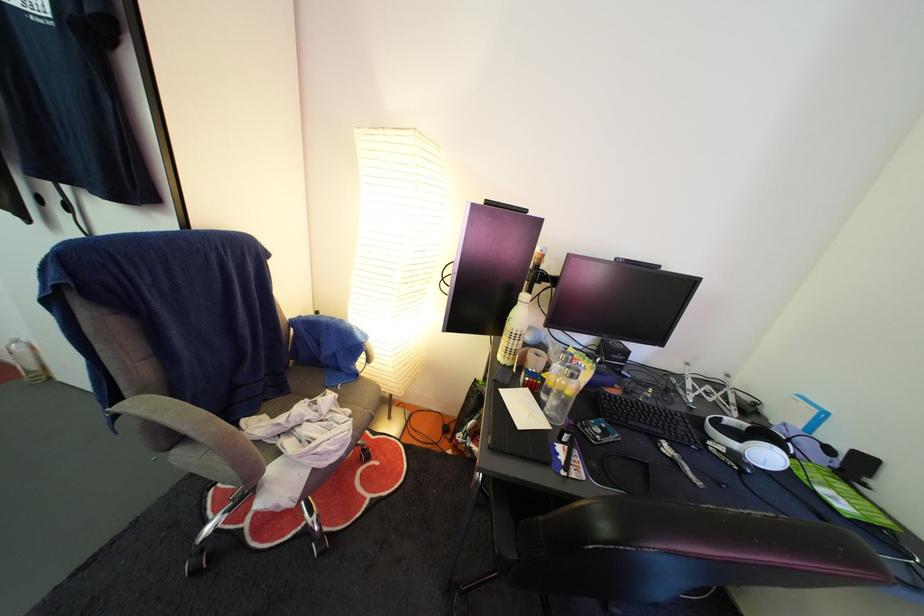
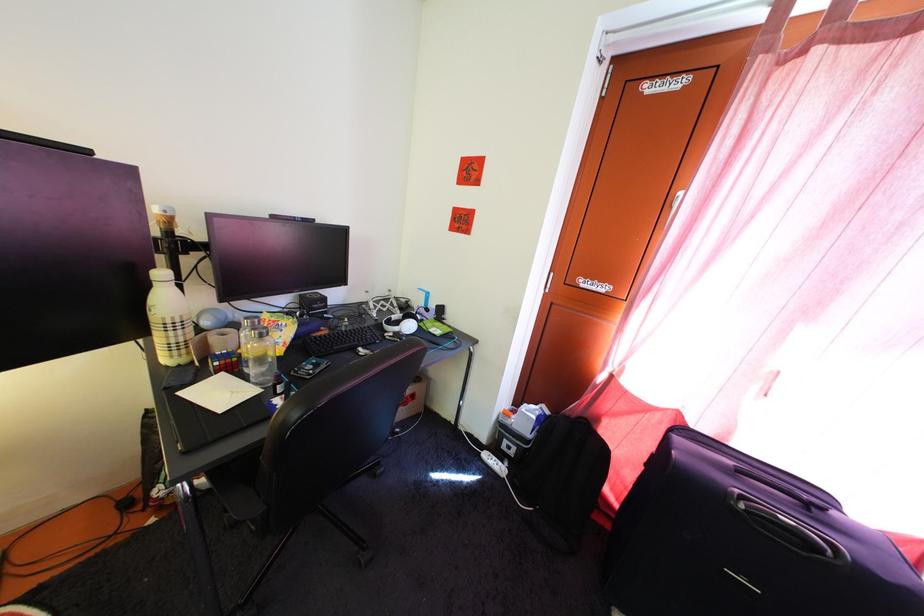
The point at [578,376] is marked in the first image. Where is the corresponding point in the second image?

(262, 338)